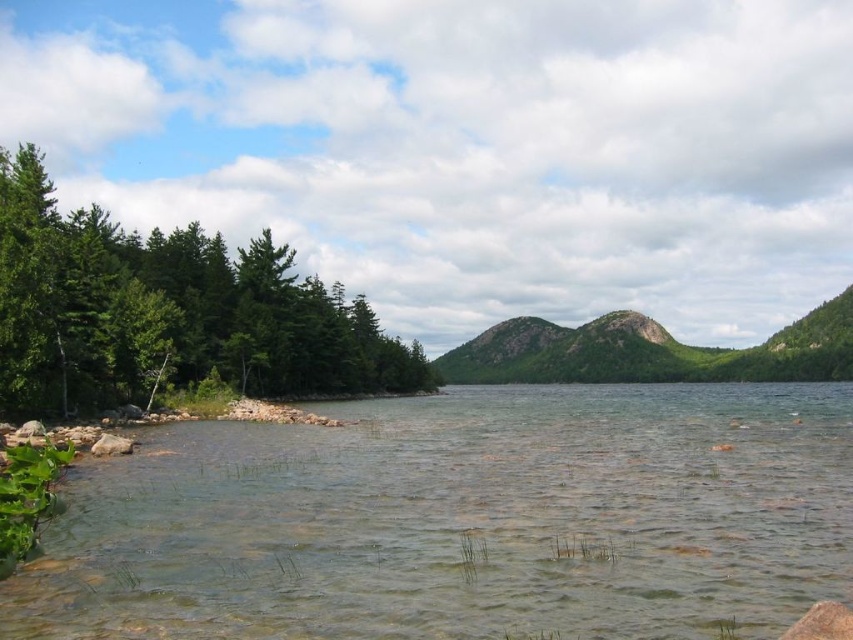
You are standing at the point marked as point (x=167, y=312) in the image. What type of vegetation is directly beneath your feet?

The point (x=167, y=312) is on green leafy trees at left, so the vegetation directly beneath your feet is part of the green leafy trees at left.

You are planning to cross the clear water at lower left to reach the green leafy trees at left. Based on their widths, which one is wider?

The clear water at lower left is wider than the green leafy trees at left.

You are a hiker standing at the edge of the clear water at lower left. You want to cross to the green textured rock at center. Is the rock submerged under the water?

The clear water at lower left is positioned over the green textured rock at center, meaning the rock is submerged under the water. Therefore, you cannot step onto the rock as it is underwater.